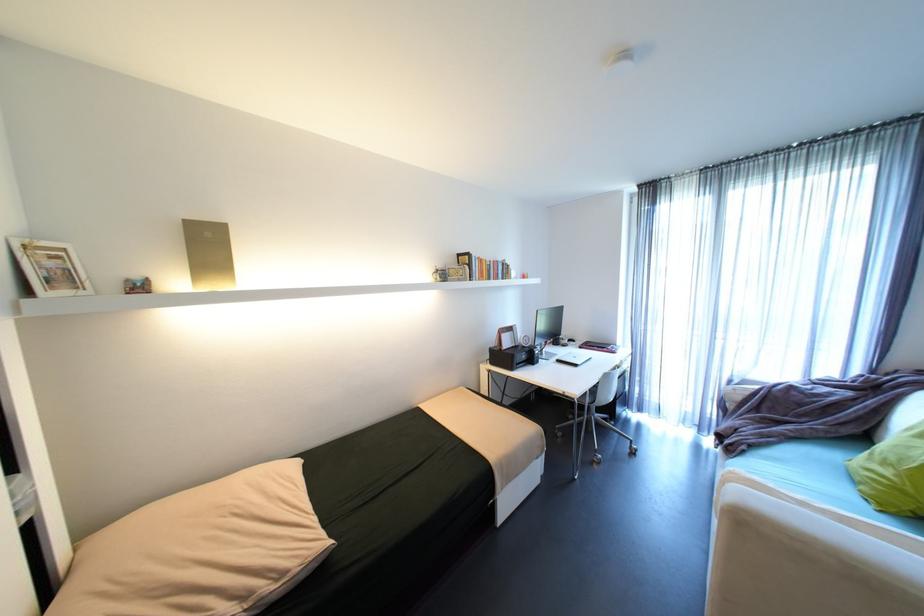
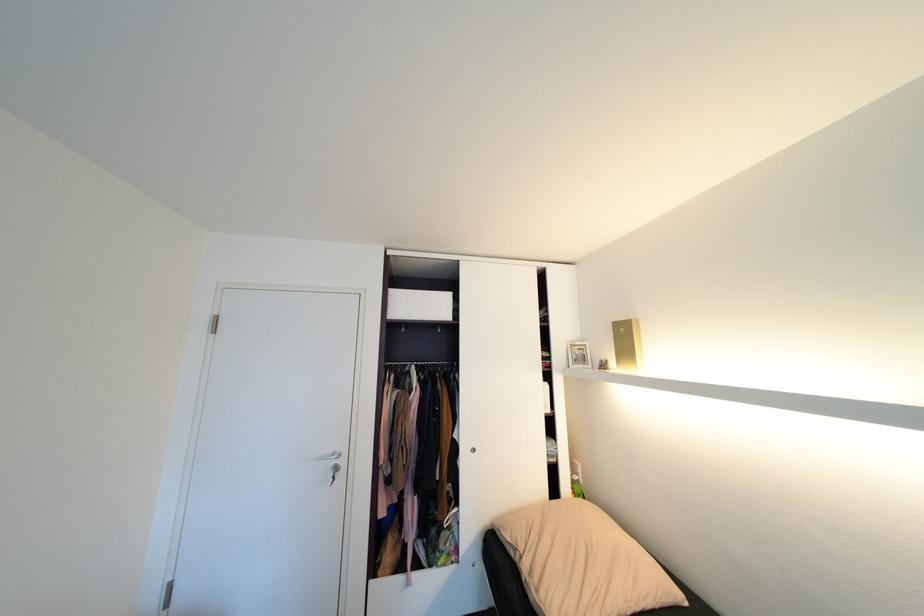
Locate, in the second image, the point that corresponds to point 190,220 in the first image.

(621, 323)